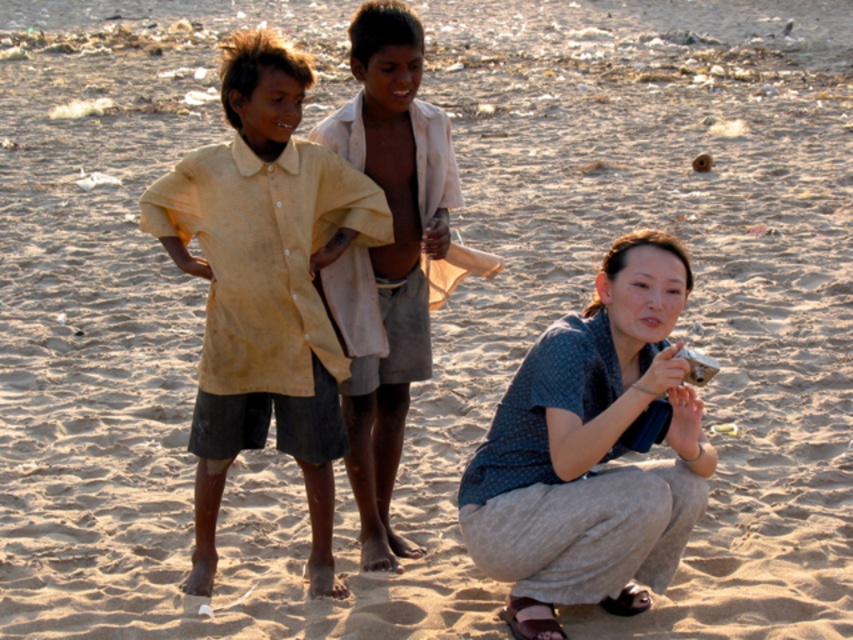
Is blue cotton shirt at lower right wider than light brown cotton shirt at center?

Yes, blue cotton shirt at lower right is wider than light brown cotton shirt at center.

Can you confirm if blue cotton shirt at lower right is smaller than light brown cotton shirt at center?

No, blue cotton shirt at lower right is not smaller than light brown cotton shirt at center.

This screenshot has width=853, height=640. In order to click on blue cotton shirt at lower right in this screenshot , I will do `click(590, 451)`.

Locate an element on the screen. This screenshot has width=853, height=640. blue cotton shirt at lower right is located at coordinates (590, 451).

Is yellow cotton shirt at center above light brown cotton shirt at center?

Actually, yellow cotton shirt at center is below light brown cotton shirt at center.

The height and width of the screenshot is (640, 853). What do you see at coordinates (265, 285) in the screenshot?
I see `yellow cotton shirt at center` at bounding box center [265, 285].

Between point (331, 417) and point (352, 326), which one is positioned behind?

Positioned behind is point (352, 326).

I want to click on yellow cotton shirt at center, so click(x=265, y=285).

Measure the distance between point [316,211] and camera.

They are 5.17 meters apart.

Can you confirm if yellow cotton shirt at center is shorter than blue cotton shirt at lower right?

No.

At what (x,y) coordinates should I click in order to perform the action: click on yellow cotton shirt at center. Please return your answer as a coordinate pair (x, y). The width and height of the screenshot is (853, 640). Looking at the image, I should click on (265, 285).

The width and height of the screenshot is (853, 640). In order to click on yellow cotton shirt at center in this screenshot , I will do `click(265, 285)`.